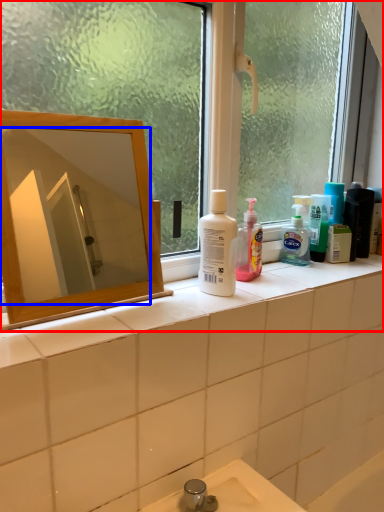
Question: Which object appears farthest to the camera in this image, window (highlighted by a red box) or mirror (highlighted by a blue box)?

Choices:
 (A) window
 (B) mirror

Answer: (B)